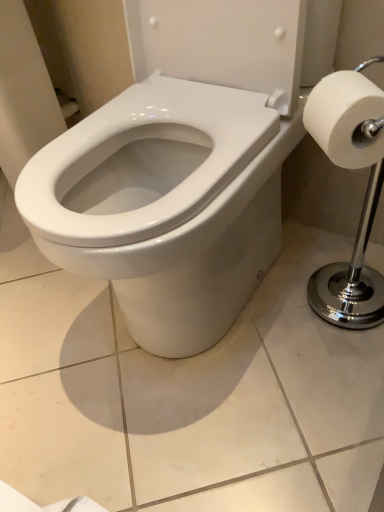
Question: Considering their positions, is white matte toilet paper at right located in front of or behind white glossy bidet at center?

Choices:
 (A) behind
 (B) front

Answer: (A)

Question: Would you say white matte toilet paper at right is to the left or to the right of white glossy bidet at center in the picture?

Choices:
 (A) left
 (B) right

Answer: (B)

Question: From the image's perspective, is white matte toilet paper at right above or below white glossy bidet at center?

Choices:
 (A) above
 (B) below

Answer: (A)

Question: Considering the positions of white glossy bidet at center and white matte toilet paper at right in the image, is white glossy bidet at center bigger or smaller than white matte toilet paper at right?

Choices:
 (A) big
 (B) small

Answer: (A)

Question: Considering their positions, is white glossy bidet at center located in front of or behind white matte toilet paper at right?

Choices:
 (A) front
 (B) behind

Answer: (A)

Question: From their relative heights in the image, would you say white glossy bidet at center is taller or shorter than white matte toilet paper at right?

Choices:
 (A) short
 (B) tall

Answer: (B)

Question: From the image's perspective, is white glossy bidet at center above or below white matte toilet paper at right?

Choices:
 (A) below
 (B) above

Answer: (A)